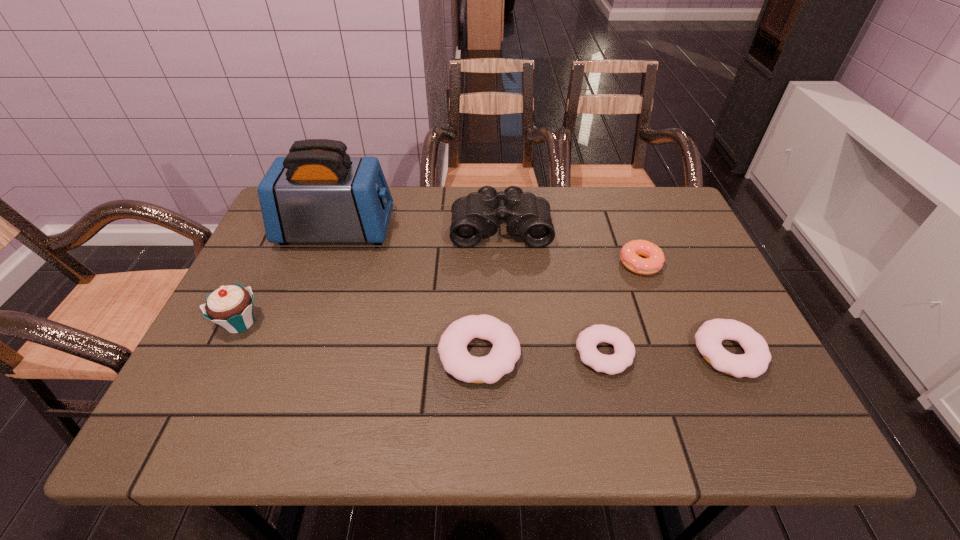
Locate an element on the screen. The image size is (960, 540). vacant region that satisfies the following two spatial constraints: 1. at the eyepieces of the binoculars; 2. on the left side of the farthest doughnut is located at coordinates (502, 264).

Where is `vacant space that satisfies the following two spatial constraints: 1. at the eyepieces of the farthest doughnut; 2. on the right side of the binoculars`? Image resolution: width=960 pixels, height=540 pixels. vacant space that satisfies the following two spatial constraints: 1. at the eyepieces of the farthest doughnut; 2. on the right side of the binoculars is located at coordinates (502, 264).

The width and height of the screenshot is (960, 540). Find the location of `free space that satisfies the following two spatial constraints: 1. at the eyepieces of the binoculars; 2. on the left side of the fifth object from left to right`. free space that satisfies the following two spatial constraints: 1. at the eyepieces of the binoculars; 2. on the left side of the fifth object from left to right is located at coordinates (507, 353).

Identify the location of free location that satisfies the following two spatial constraints: 1. on the front side of the shortest object; 2. on the right side of the cupcake. point(225,353).

Locate an element on the screen. This screenshot has width=960, height=540. free space that satisfies the following two spatial constraints: 1. at the eyepieces of the binoculars; 2. on the left side of the shortest doughnut is located at coordinates (507, 353).

Where is `vacant space that satisfies the following two spatial constraints: 1. at the eyepieces of the farthest doughnut; 2. on the left side of the binoculars`? The width and height of the screenshot is (960, 540). vacant space that satisfies the following two spatial constraints: 1. at the eyepieces of the farthest doughnut; 2. on the left side of the binoculars is located at coordinates (502, 264).